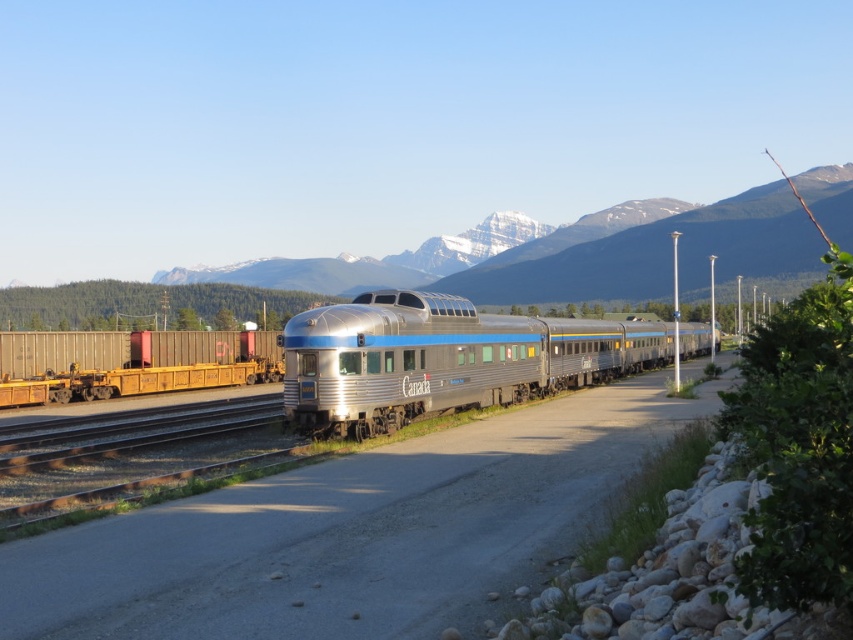
Question: Can you confirm if silver metallic train at center is positioned above snowy mountain at center?

Choices:
 (A) no
 (B) yes

Answer: (A)

Question: Which object is farther from the camera taking this photo?

Choices:
 (A) snowy mountain at center
 (B) silver metallic train at center

Answer: (A)

Question: Is silver metallic train at center thinner than snowy mountain at center?

Choices:
 (A) yes
 (B) no

Answer: (A)

Question: Which object appears closest to the camera in this image?

Choices:
 (A) snowy mountain at center
 (B) silver metallic train at center

Answer: (B)

Question: Can you confirm if silver metallic train at center is positioned below snowy mountain at center?

Choices:
 (A) yes
 (B) no

Answer: (A)